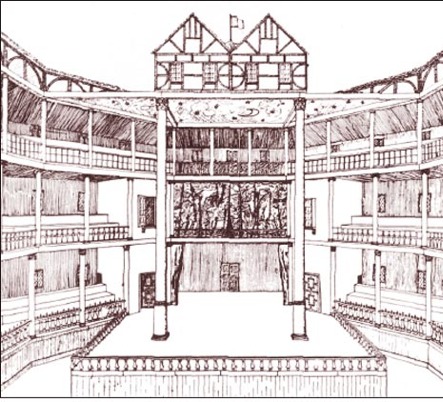
Find the location of a particular element. The width and height of the screenshot is (443, 402). curtians is located at coordinates (175, 260), (282, 254).